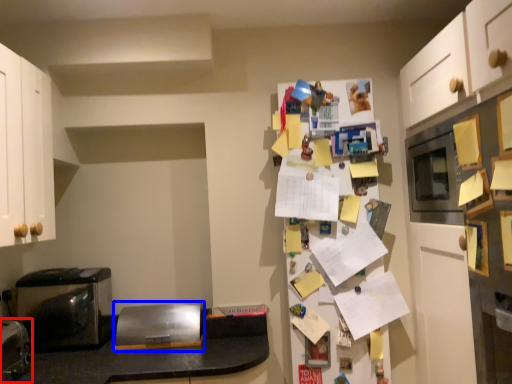
Question: Which object is closer to the camera taking this photo, appliance (highlighted by a red box) or appliance (highlighted by a blue box)?

Choices:
 (A) appliance
 (B) appliance

Answer: (A)